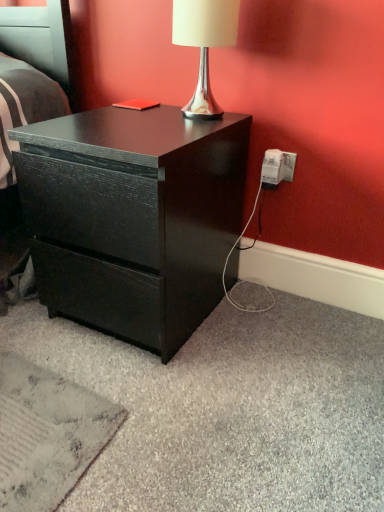
Consider the image. In order to face white plastic power outlet at lower right, should I rotate leftwards or rightwards?

You should rotate right by 11.593 degrees.

Identify the location of matte black drawer at center. The image size is (384, 512). (133, 217).

Between point (279, 173) and point (218, 172), which one is positioned in front?

The point (218, 172) is more forward.

Who is smaller, white plastic power outlet at lower right or matte black drawer at center?

Smaller between the two is white plastic power outlet at lower right.

The width and height of the screenshot is (384, 512). In the image, there is a white plastic power outlet at lower right. Find the location of `desk below it (from the image's perspective)`. desk below it (from the image's perspective) is located at coordinates (133, 217).

Is white plastic power outlet at lower right facing away from matte black drawer at center?

No, matte black drawer at center is not at the back of white plastic power outlet at lower right.

Considering the relative positions of silver metallic lamp at upper center and matte black drawer at center in the image provided, is silver metallic lamp at upper center to the left or to the right of matte black drawer at center?

silver metallic lamp at upper center is to the right of matte black drawer at center.

Are silver metallic lamp at upper center and matte black drawer at center far apart?

Actually, silver metallic lamp at upper center and matte black drawer at center are a little close together.

In the scene shown: From a real-world perspective, is silver metallic lamp at upper center above or below matte black drawer at center?

Clearly, from a real-world perspective, silver metallic lamp at upper center is above matte black drawer at center.

Can you confirm if matte black drawer at center is taller than white plastic power outlet at lower right?

Indeed, matte black drawer at center has a greater height compared to white plastic power outlet at lower right.

From the image's perspective, between matte black drawer at center and white plastic power outlet at lower right, which one is located above?

white plastic power outlet at lower right appears higher in the image.

How many degrees apart are the facing directions of matte black drawer at center and white plastic power outlet at lower right?

The angle between the facing direction of matte black drawer at center and the facing direction of white plastic power outlet at lower right is 2.58 degrees.

Is matte black drawer at center positioned far away from white plastic power outlet at lower right?

No, matte black drawer at center is not far from white plastic power outlet at lower right.

From a real-world perspective, between white plastic power outlet at lower right and silver metallic lamp at upper center, who is vertically higher?

silver metallic lamp at upper center, from a real-world perspective.

Which of these two, white plastic power outlet at lower right or silver metallic lamp at upper center, stands taller?

silver metallic lamp at upper center.

Are white plastic power outlet at lower right and silver metallic lamp at upper center located far from each other?

They are positioned close to each other.

Is white plastic power outlet at lower right to the left or to the right of silver metallic lamp at upper center in the image?

From the image, it's evident that white plastic power outlet at lower right is to the right of silver metallic lamp at upper center.

Who is bigger, silver metallic lamp at upper center or white plastic power outlet at lower right?

Bigger between the two is silver metallic lamp at upper center.

Can you confirm if silver metallic lamp at upper center is positioned to the right of white plastic power outlet at lower right?

No.

Is silver metallic lamp at upper center looking in the opposite direction of white plastic power outlet at lower right?

No.

From a real-world perspective, is matte black drawer at center under silver metallic lamp at upper center?

Result: Yes.

Which is nearer, (60, 155) or (200, 90)?

Point (60, 155) appears to be closer to the viewer than point (200, 90).

Are matte black drawer at center and silver metallic lamp at upper center making contact?

No, matte black drawer at center is not in contact with silver metallic lamp at upper center.

Is matte black drawer at center oriented towards silver metallic lamp at upper center?

No, matte black drawer at center is not facing towards silver metallic lamp at upper center.

You are a GUI agent. You are given a task and a screenshot of the screen. Output one action in this format:
    pyautogui.click(x=<x>, y=<y>)
    Task: Click on the desk on the left of white plastic power outlet at lower right
    This screenshot has width=384, height=512.
    Given the screenshot: What is the action you would take?
    pyautogui.click(x=133, y=217)

Where is `lamp that is behind the matte black drawer at center`? lamp that is behind the matte black drawer at center is located at coordinates (204, 44).

Looking at the image, which one is located closer to silver metallic lamp at upper center, white plastic power outlet at lower right or matte black drawer at center?

Based on the image, white plastic power outlet at lower right appears to be nearer to silver metallic lamp at upper center.

From the image, which object appears to be nearer to silver metallic lamp at upper center, matte black drawer at center or white plastic power outlet at lower right?

Among the two, white plastic power outlet at lower right is located nearer to silver metallic lamp at upper center.

From the image, which object appears to be farther from white plastic power outlet at lower right, silver metallic lamp at upper center or matte black drawer at center?

The object further to white plastic power outlet at lower right is matte black drawer at center.

Estimate the real-world distances between objects in this image. Which object is further from matte black drawer at center, silver metallic lamp at upper center or white plastic power outlet at lower right?

Based on the image, white plastic power outlet at lower right appears to be further to matte black drawer at center.

When comparing their distances from white plastic power outlet at lower right, does matte black drawer at center or silver metallic lamp at upper center seem further?

matte black drawer at center is positioned further to the anchor white plastic power outlet at lower right.

From the image, which object appears to be nearer to matte black drawer at center, white plastic power outlet at lower right or silver metallic lamp at upper center?

silver metallic lamp at upper center is positioned closer to the anchor matte black drawer at center.

Locate an element on the screen. The height and width of the screenshot is (512, 384). lamp between matte black drawer at center and white plastic power outlet at lower right along the z-axis is located at coordinates (204, 44).